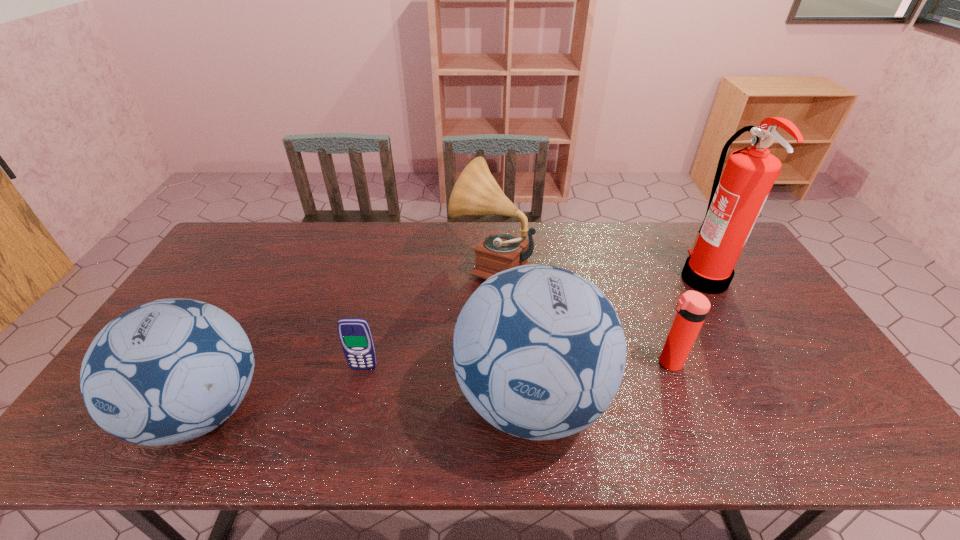
This screenshot has height=540, width=960. What are the coordinates of `free space that satisfies the following two spatial constraints: 1. with the nozzle aimed from the tallest object; 2. on the front-facing side of the cellular telephone` in the screenshot? It's located at (756, 368).